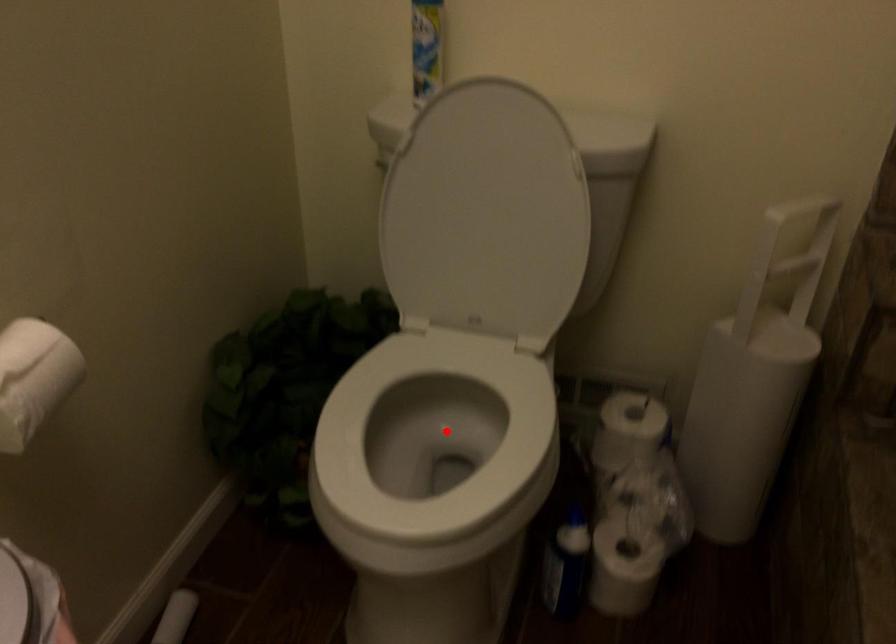
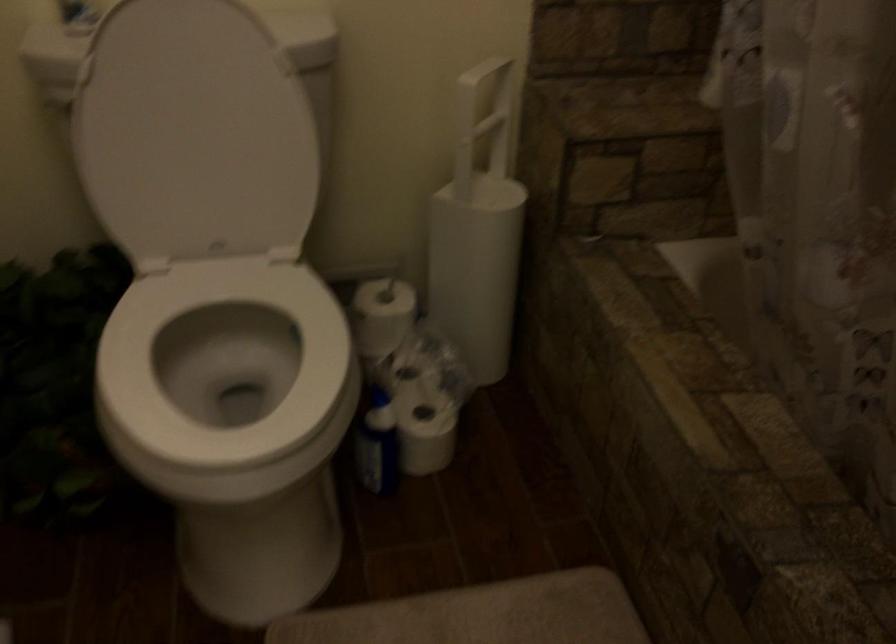
Locate, in the second image, the point that corresponds to the highlighted location in the first image.

(224, 365)